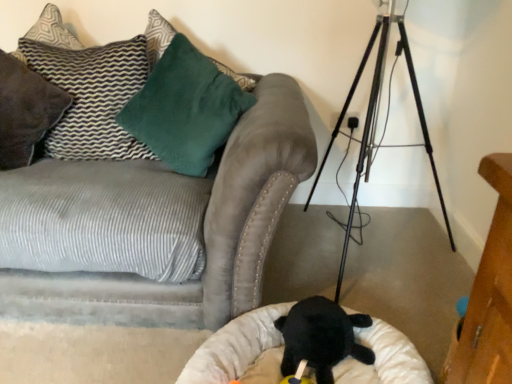
Where is `free area below metallic tripod at center (from a real-world perspective)`? This screenshot has height=384, width=512. free area below metallic tripod at center (from a real-world perspective) is located at coordinates (347, 260).